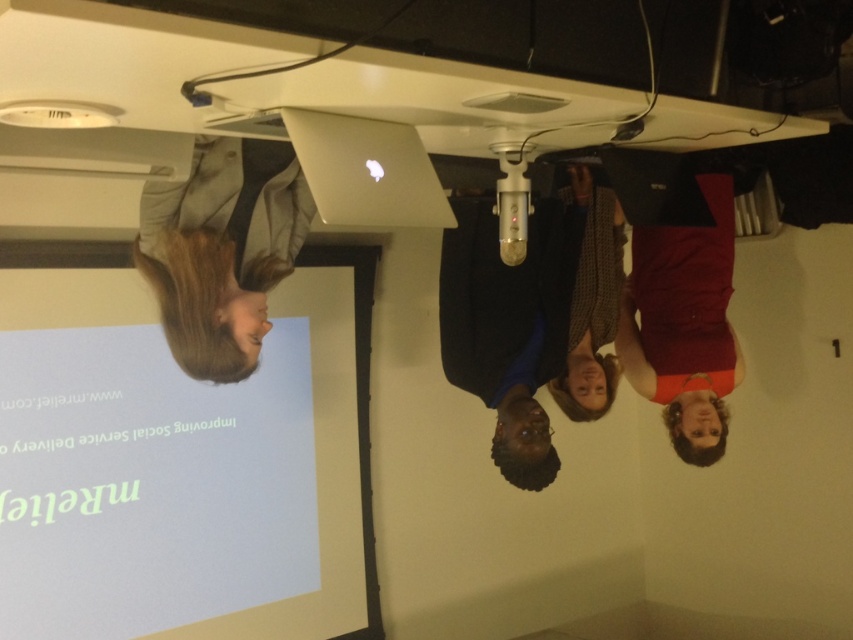
You are a photographer standing in the room and want to take a closeup photo of the matte red dress at right without moving any other objects. Can you step forward to get a closer shot?

The matte red dress at right is 1.85 meters away from viewer. If you step forward, you can reduce the distance to achieve a closer shot as long as you don

You are attending a virtual meeting and need to share your screen. You see the silver metallic laptop at upper center and the matte red dress at right. Which object is closer to the right edge of the screen?

The matte red dress at right is closer to the right edge of the screen because it is positioned to the right of the silver metallic laptop at upper center.

You are an event planner organizing a photoshoot for a fashion show. You need to place a mannequin wearing the light brown leather jacket at upper left and another wearing the matte red dress at right in a way that maintains their size relationship as seen in the original image. Which garment should be placed closer to the camera to achieve this?

The light brown leather jacket at upper left should be placed closer to the camera because it is smaller in size compared to the matte red dress at right, which will help maintain their relative sizes as seen in the original image.